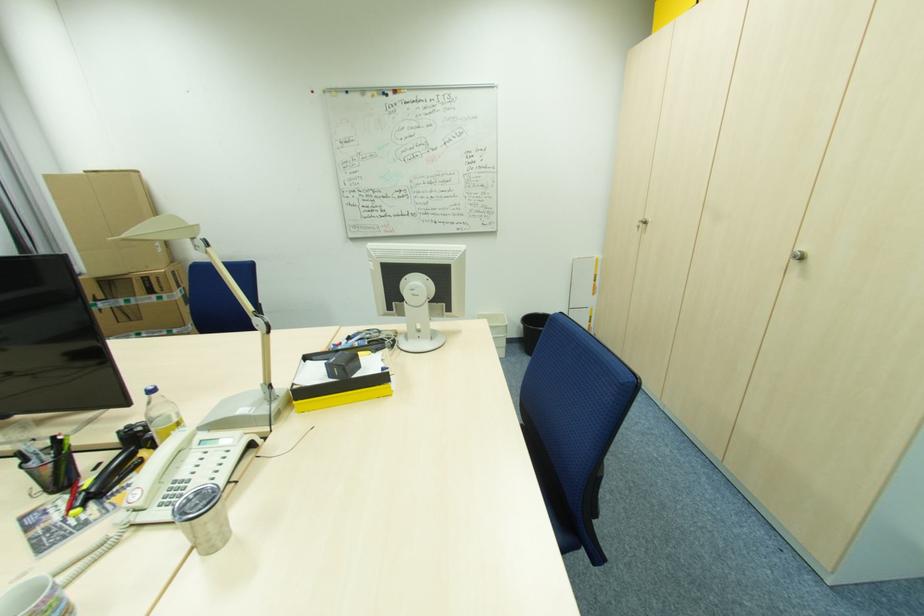
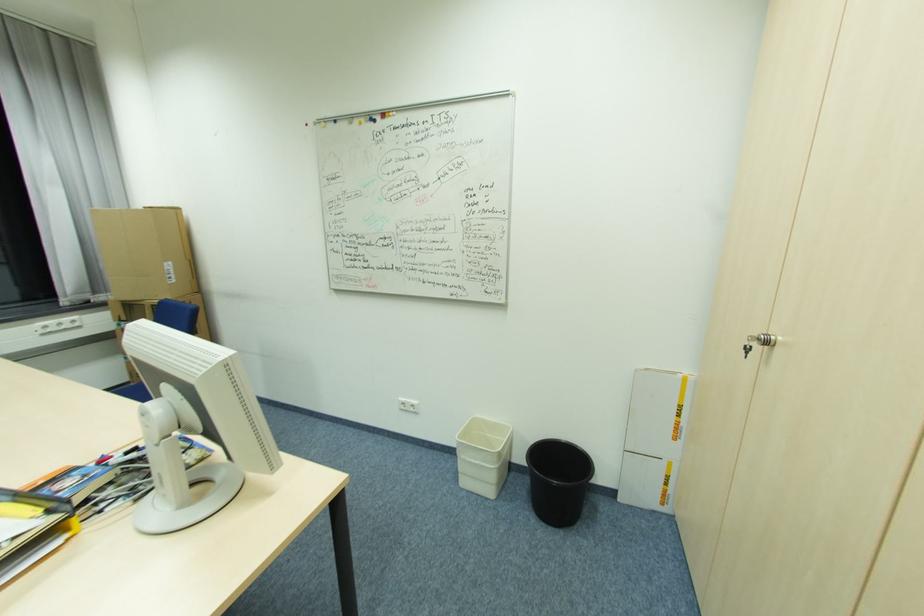
Find the pixel in the second image that matches (x=463, y=254) in the first image.

(207, 371)